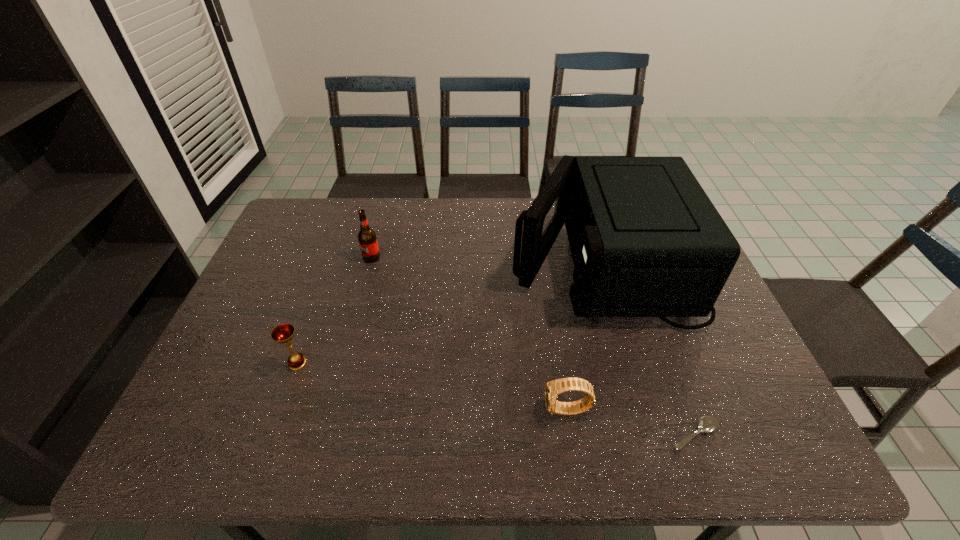
Identify the location of empty space between the second shortest object and the tallest object. The height and width of the screenshot is (540, 960). (585, 335).

The height and width of the screenshot is (540, 960). Find the location of `free space between the leftmost object and the second shortest object`. free space between the leftmost object and the second shortest object is located at coordinates (432, 387).

You are a GUI agent. You are given a task and a screenshot of the screen. Output one action in this format:
    pyautogui.click(x=<x>, y=<y>)
    Task: Click on the vacant point located between the tallest object and the third nearest object
    The image size is (960, 540).
    Given the screenshot: What is the action you would take?
    pyautogui.click(x=449, y=312)

Find the location of a particular element. The image size is (960, 540). free space between the shortest object and the third farthest object is located at coordinates (496, 399).

Locate an element on the screen. The height and width of the screenshot is (540, 960). free space between the shortest object and the root beer is located at coordinates (533, 346).

Where is `free space between the watch and the shortest object`? free space between the watch and the shortest object is located at coordinates (631, 423).

I want to click on vacant area that lies between the microwave oven and the chalice, so click(x=449, y=312).

You are a GUI agent. You are given a task and a screenshot of the screen. Output one action in this format:
    pyautogui.click(x=<x>, y=<y>)
    Task: Click on the vacant area between the shortest object and the second tallest object
    
    Given the screenshot: What is the action you would take?
    pyautogui.click(x=533, y=346)

Where is `object that is the third closest one to the microwave oven`? object that is the third closest one to the microwave oven is located at coordinates (367, 239).

Where is `object that is the second nearest to the tallest object`? object that is the second nearest to the tallest object is located at coordinates (707, 424).